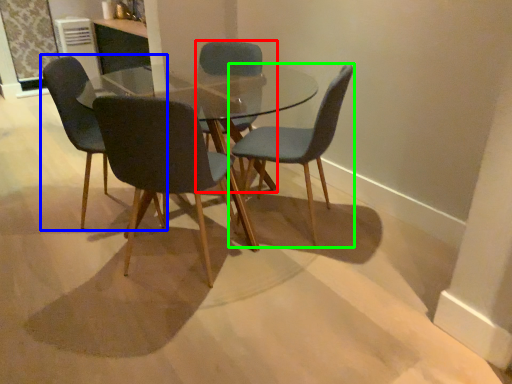
Question: Which object is positioned farthest from chair (highlighted by a red box)? Select from chair (highlighted by a blue box) and chair (highlighted by a green box).

Choices:
 (A) chair
 (B) chair

Answer: (A)